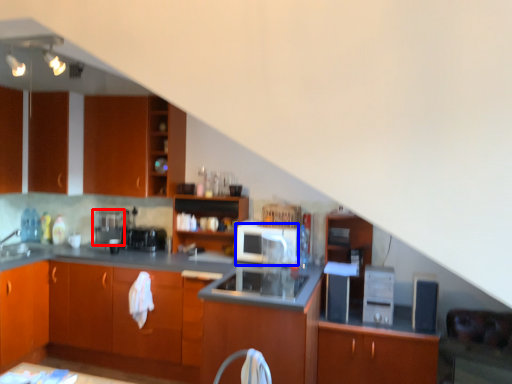
Question: Which object appears closest to the camera in this image, coffee machine (highlighted by a red box) or appliance (highlighted by a blue box)?

Choices:
 (A) coffee machine
 (B) appliance

Answer: (B)